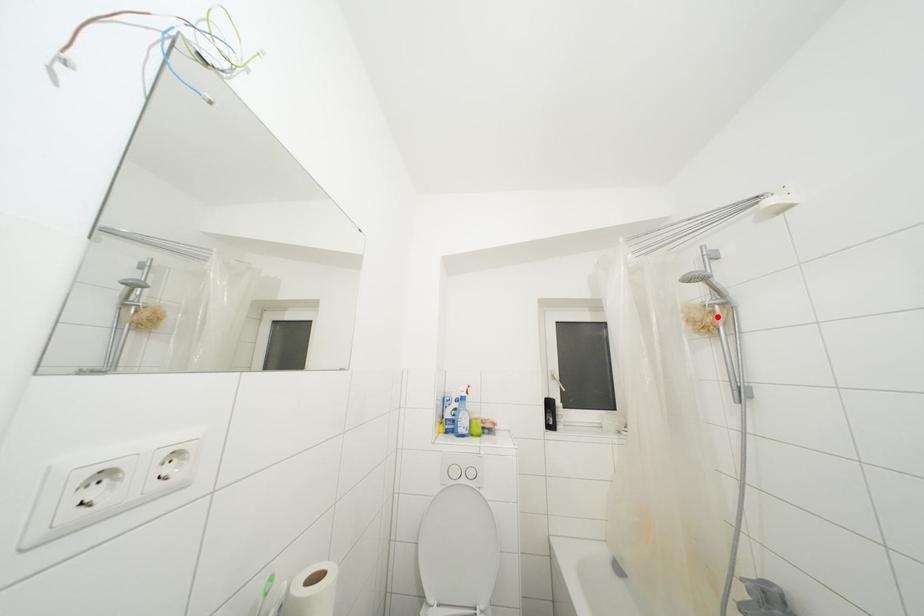
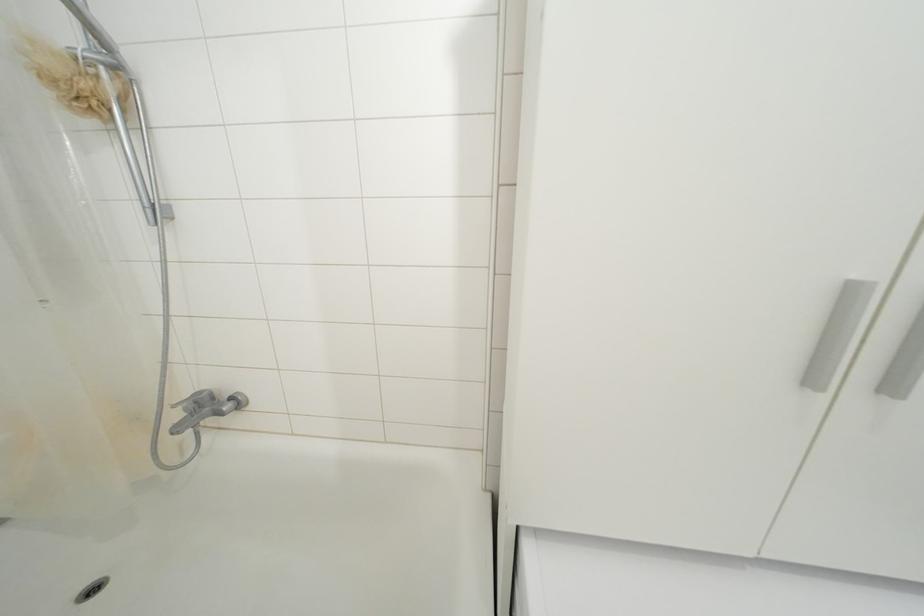
The point at the highlighted location is marked in the first image. Where is the corresponding point in the second image?

(100, 79)